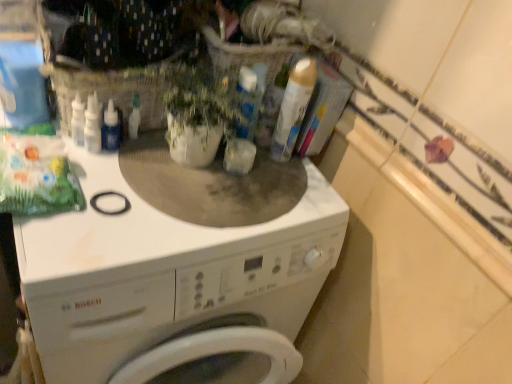
Question: Is white glossy counter top at upper right turned away from green matte plant at center?

Choices:
 (A) yes
 (B) no

Answer: (B)

Question: Is white glossy counter top at upper right not within green matte plant at center?

Choices:
 (A) yes
 (B) no

Answer: (A)

Question: Can you confirm if white glossy counter top at upper right is shorter than green matte plant at center?

Choices:
 (A) yes
 (B) no

Answer: (A)

Question: Is white glossy counter top at upper right wider than green matte plant at center?

Choices:
 (A) yes
 (B) no

Answer: (B)

Question: Is white glossy counter top at upper right thinner than green matte plant at center?

Choices:
 (A) no
 (B) yes

Answer: (B)

Question: From a real-world perspective, does white glossy counter top at upper right sit lower than green matte plant at center?

Choices:
 (A) yes
 (B) no

Answer: (B)

Question: Could you tell me if green matte plant at center is turned towards gold metallic can at upper center?

Choices:
 (A) yes
 (B) no

Answer: (B)

Question: Is green matte plant at center smaller than gold metallic can at upper center?

Choices:
 (A) no
 (B) yes

Answer: (A)

Question: Does green matte plant at center have a greater height compared to gold metallic can at upper center?

Choices:
 (A) yes
 (B) no

Answer: (B)

Question: From the image's perspective, is green matte plant at center located above gold metallic can at upper center?

Choices:
 (A) no
 (B) yes

Answer: (A)

Question: Considering the relative sizes of green matte plant at center and gold metallic can at upper center in the image provided, is green matte plant at center shorter than gold metallic can at upper center?

Choices:
 (A) yes
 (B) no

Answer: (A)

Question: Is green matte plant at center touching gold metallic can at upper center?

Choices:
 (A) no
 (B) yes

Answer: (A)

Question: Would you consider gold metallic can at upper center to be distant from white glossy counter top at upper right?

Choices:
 (A) yes
 (B) no

Answer: (B)